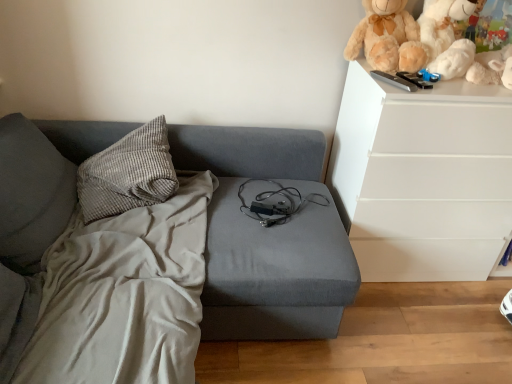
Question: Should I look upward or downward to see white plush teddy bear at upper right?

Choices:
 (A) up
 (B) down

Answer: (A)

Question: Is the position of white plush toy at upper right more distant than that of gray corduroy pillow at upper left?

Choices:
 (A) no
 (B) yes

Answer: (B)

Question: Is white plush toy at upper right positioned in front of gray corduroy pillow at upper left?

Choices:
 (A) no
 (B) yes

Answer: (A)

Question: Is white plush toy at upper right placed right next to gray corduroy pillow at upper left?

Choices:
 (A) yes
 (B) no

Answer: (B)

Question: Is white plush toy at upper right far from gray corduroy pillow at upper left?

Choices:
 (A) no
 (B) yes

Answer: (B)

Question: Would you say gray corduroy pillow at upper left is part of white plush toy at upper right's contents?

Choices:
 (A) yes
 (B) no

Answer: (B)

Question: From a real-world perspective, does white plush toy at upper right stand above gray corduroy pillow at upper left?

Choices:
 (A) no
 (B) yes

Answer: (B)

Question: From a real-world perspective, is gray corduroy pillow at upper left under fluffy beige teddy bear at upper right?

Choices:
 (A) no
 (B) yes

Answer: (B)

Question: Is gray corduroy pillow at upper left further to camera compared to fluffy beige teddy bear at upper right?

Choices:
 (A) yes
 (B) no

Answer: (B)

Question: Is gray corduroy pillow at upper left looking in the opposite direction of fluffy beige teddy bear at upper right?

Choices:
 (A) yes
 (B) no

Answer: (B)

Question: Can you confirm if gray corduroy pillow at upper left is positioned to the left of fluffy beige teddy bear at upper right?

Choices:
 (A) yes
 (B) no

Answer: (A)

Question: Would you say gray corduroy pillow at upper left contains fluffy beige teddy bear at upper right?

Choices:
 (A) yes
 (B) no

Answer: (B)

Question: Is gray corduroy pillow at upper left not within fluffy beige teddy bear at upper right?

Choices:
 (A) yes
 (B) no

Answer: (A)

Question: Is the position of white plush teddy bear at upper right more distant than that of white plush toy at upper right?

Choices:
 (A) yes
 (B) no

Answer: (A)